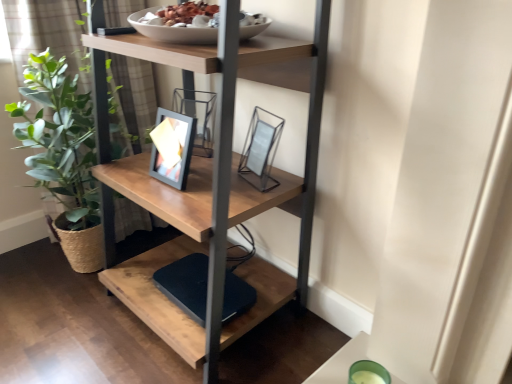
Question: Is black matte lift at lower center at the left side of metallic glass picture frame at center?

Choices:
 (A) no
 (B) yes

Answer: (B)

Question: Does black matte lift at lower center turn towards metallic glass picture frame at center?

Choices:
 (A) no
 (B) yes

Answer: (A)

Question: From a real-world perspective, is black matte lift at lower center on top of metallic glass picture frame at center?

Choices:
 (A) no
 (B) yes

Answer: (A)

Question: Is black matte lift at lower center not within metallic glass picture frame at center?

Choices:
 (A) no
 (B) yes

Answer: (B)

Question: Considering the relative sizes of black matte lift at lower center and metallic glass picture frame at center in the image provided, is black matte lift at lower center wider than metallic glass picture frame at center?

Choices:
 (A) no
 (B) yes

Answer: (B)

Question: Is green leafy plant at left to the left or to the right of metallic glass picture frame at center in the image?

Choices:
 (A) right
 (B) left

Answer: (B)

Question: Is green leafy plant at left inside the boundaries of metallic glass picture frame at center, or outside?

Choices:
 (A) inside
 (B) outside

Answer: (B)

Question: From their relative heights in the image, would you say green leafy plant at left is taller or shorter than metallic glass picture frame at center?

Choices:
 (A) tall
 (B) short

Answer: (A)

Question: In terms of size, does green leafy plant at left appear bigger or smaller than metallic glass picture frame at center?

Choices:
 (A) small
 (B) big

Answer: (B)

Question: From the image's perspective, relative to wooden shelf at center, is metallic glass picture frame at center above or below?

Choices:
 (A) above
 (B) below

Answer: (A)

Question: Is metallic glass picture frame at center in front of or behind wooden shelf at center in the image?

Choices:
 (A) behind
 (B) front

Answer: (A)

Question: From a real-world perspective, is metallic glass picture frame at center positioned above or below wooden shelf at center?

Choices:
 (A) below
 (B) above

Answer: (B)

Question: Choose the correct answer: Is metallic glass picture frame at center inside wooden shelf at center or outside it?

Choices:
 (A) outside
 (B) inside

Answer: (B)

Question: Considering the positions of wooden shelf at center and green leafy plant at left in the image, is wooden shelf at center taller or shorter than green leafy plant at left?

Choices:
 (A) tall
 (B) short

Answer: (A)

Question: From a real-world perspective, is wooden shelf at center positioned above or below green leafy plant at left?

Choices:
 (A) above
 (B) below

Answer: (A)